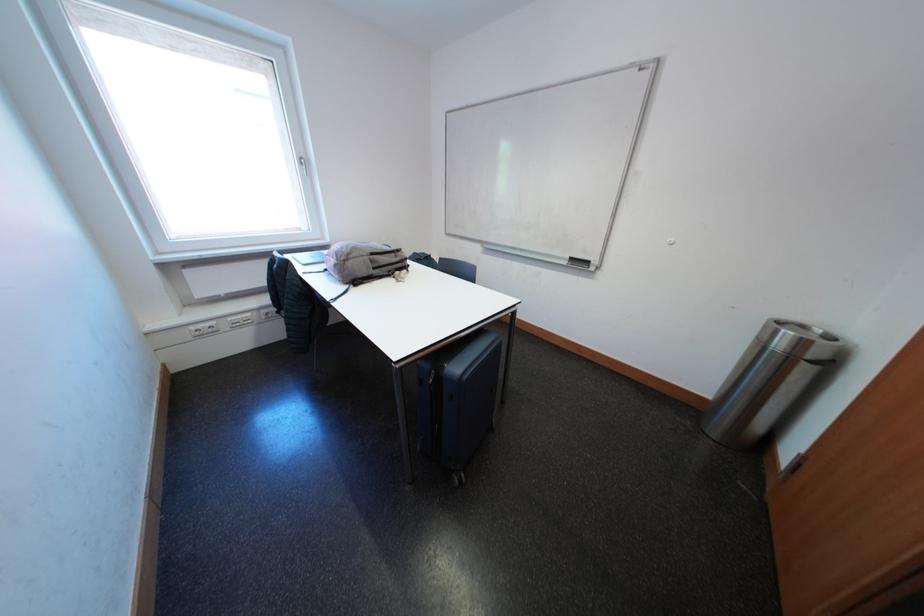
This screenshot has height=616, width=924. In order to click on grey backpack handle in this screenshot , I will do `click(386, 262)`.